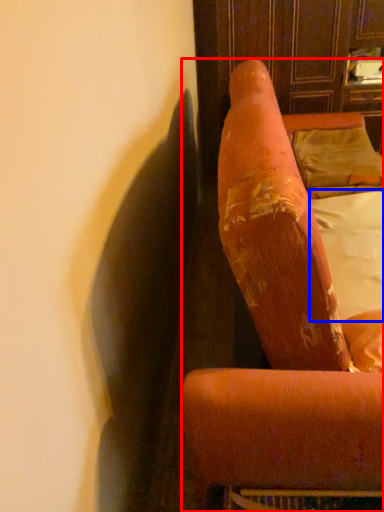
Question: Among these objects, which one is farthest to the camera, furniture (highlighted by a red box) or sheet (highlighted by a blue box)?

Choices:
 (A) furniture
 (B) sheet

Answer: (B)